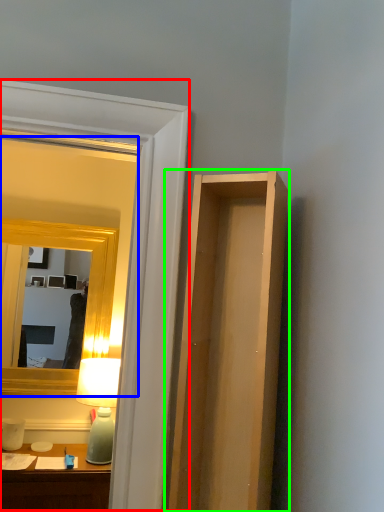
Question: Which object is positioned farthest from glass door (highlighted by a red box)? Select from mirror (highlighted by a blue box) and cabinet (highlighted by a green box).

Choices:
 (A) mirror
 (B) cabinet

Answer: (A)